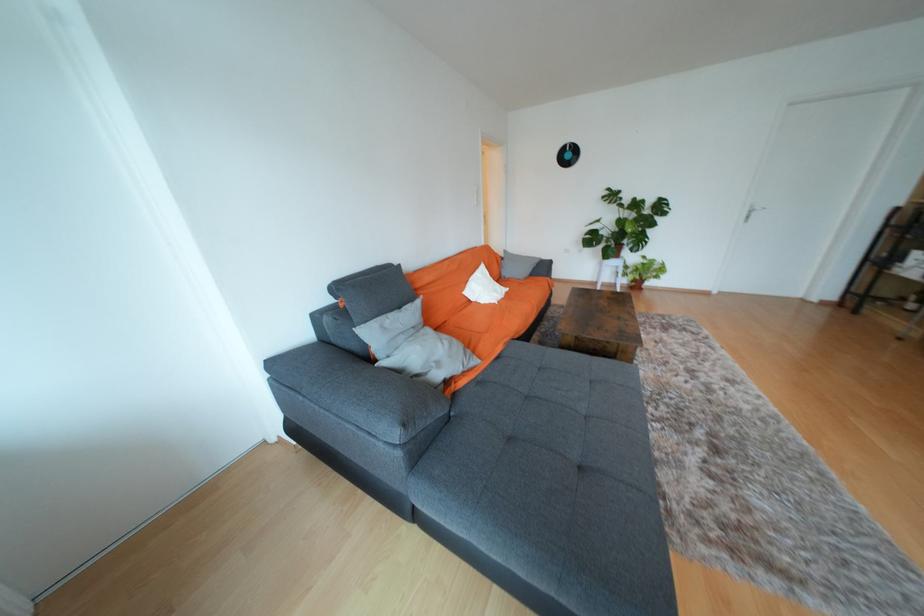
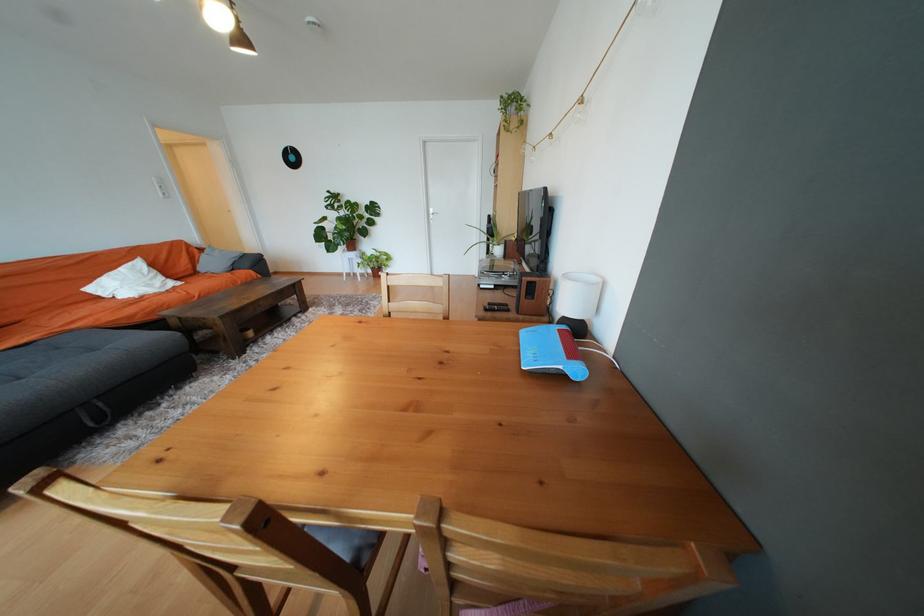
Find the pixel in the second image that matches pixel 473 294 in the first image.

(96, 291)